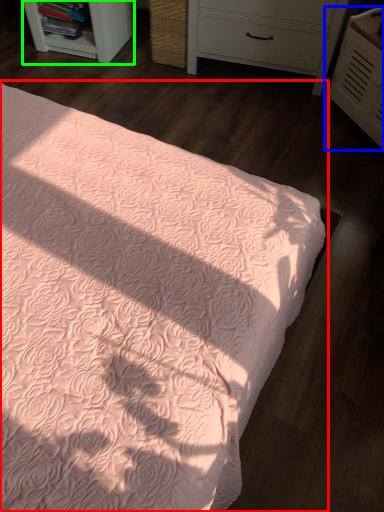
Question: Which object is positioned farthest from bed (highlighted by a red box)? Select from chest of drawers (highlighted by a blue box) and shelf (highlighted by a green box).

Choices:
 (A) chest of drawers
 (B) shelf

Answer: (B)